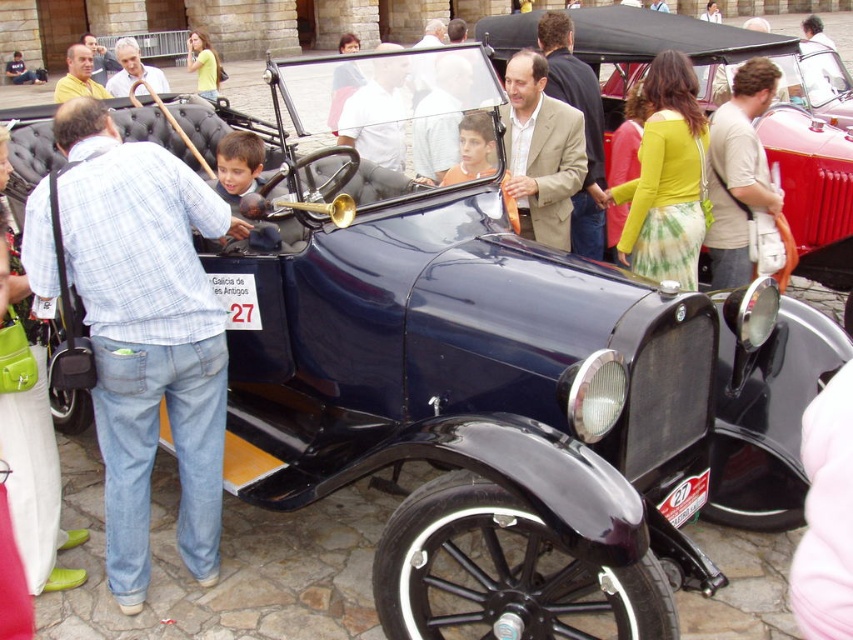
Consider the image. You are standing in front of the vintage car and want to place a small decoration between the two points, point (556, 193) and point (448, 72). Which point is closer to you so you can place the decoration there?

Point (448, 72) is closer to you because it is less further than point (556, 193).

You are a tailor observing a group of people at a vintage car event. You notice two jackets at the center of the scene. Which jacket would require more fabric to make, the matte beige blazer at center or the matte brown jacket at center?

The matte beige blazer at center is bigger than the matte brown jacket at center, so it would require more fabric to make.